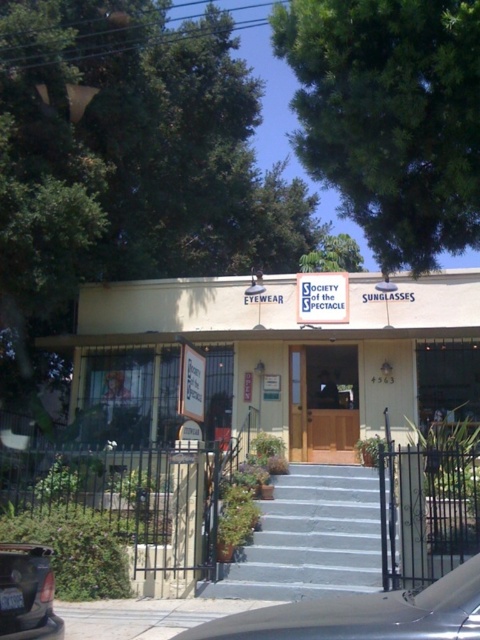
You are a delivery person needing to reach the entrance of the building. You see the gray concrete stairs at center and the silver metallic car at center. Which object is closer to the entrance?

The gray concrete stairs at center is closer to the entrance because it is positioned to the right of the silver metallic car at center, implying the stairs are nearer to the building entrance than the car.

You are a customer arriving at the building and need to park your car. You see the silver metallic car at center and the matte black car at lower left. Which parking spot is closer to the entrance?

The silver metallic car at center is closer to the entrance because it is located above the matte black car at lower left, which is positioned further away from the entrance.

You are standing at the entrance of the building and want to place a new potted plant exactly at the point with coordinates point (310, 538). According to the scene description, where will the potted plant be placed?

The point (310, 538) corresponds to the gray concrete stairs at center, so placing the potted plant there would put it on the gray concrete stairs at center.